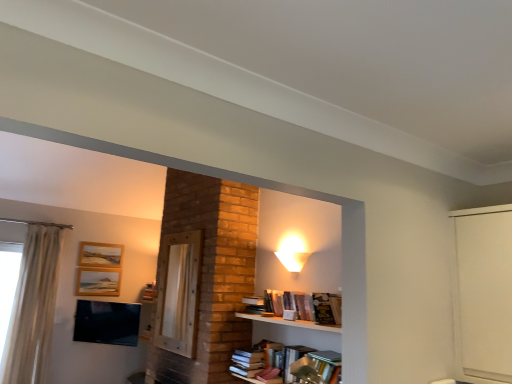
Question: Looking at the image, does hardcover books at center seem bigger or smaller compared to wooden picture frame at upper left, which is the second picture frame in top-to-bottom order?

Choices:
 (A) big
 (B) small

Answer: (A)

Question: Does point (245, 349) appear closer or farther from the camera than point (102, 286)?

Choices:
 (A) closer
 (B) farther

Answer: (A)

Question: Which object is the farthest from the white frosted glass lampshade at upper center?

Choices:
 (A) wooden picture frame at upper left, which appears as the 1th picture frame when ordered from the bottom
 (B) hardcover books at center
 (C) white sheer curtain at left
 (D) wooden picture frame at upper left, marked as the 1th picture frame in a top-to-bottom arrangement
 (E) matte black tv at lower left

Answer: (C)

Question: Considering the real-world distances, which object is farthest from the wooden picture frame at upper left, which is the second picture frame in top-to-bottom order?

Choices:
 (A) matte black tv at lower left
 (B) hardcover books at center
 (C) white frosted glass lampshade at upper center
 (D) white sheer curtain at left
 (E) wooden picture frame at upper left, marked as the 1th picture frame in a top-to-bottom arrangement

Answer: (C)